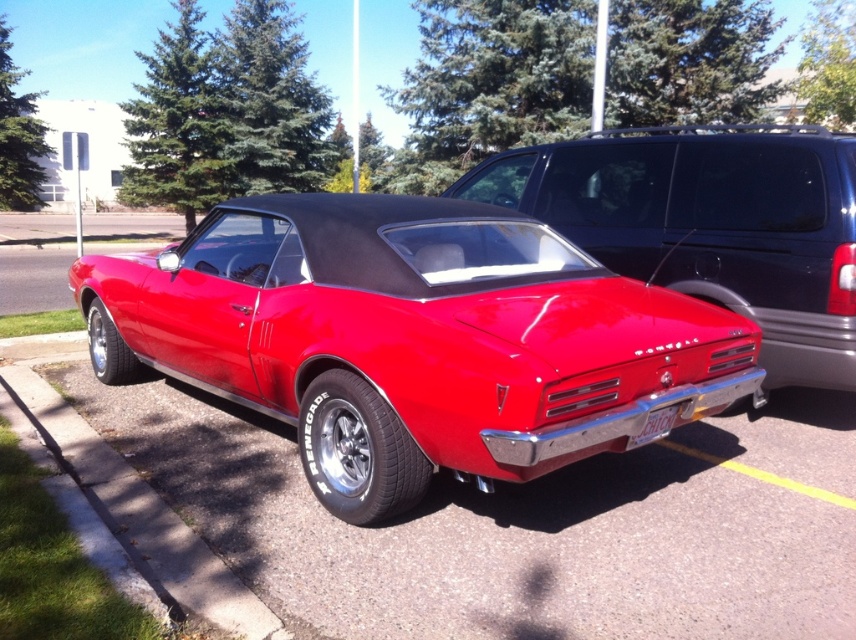
Question: Which of the following is the farthest from the observer?

Choices:
 (A) shiny red car at center
 (B) glossy black suv at upper right

Answer: (B)

Question: Is shiny red car at center to the right of glossy black suv at upper right from the viewer's perspective?

Choices:
 (A) yes
 (B) no

Answer: (B)

Question: Does glossy black suv at upper right appear under white plastic license plate at rear?

Choices:
 (A) no
 (B) yes

Answer: (A)

Question: Which point appears closest to the camera in this image?

Choices:
 (A) (541, 228)
 (B) (807, 205)

Answer: (A)

Question: Among these objects, which one is farthest from the camera?

Choices:
 (A) glossy black suv at upper right
 (B) shiny red car at center

Answer: (A)

Question: Does shiny red car at center appear under white plastic license plate at rear?

Choices:
 (A) no
 (B) yes

Answer: (A)